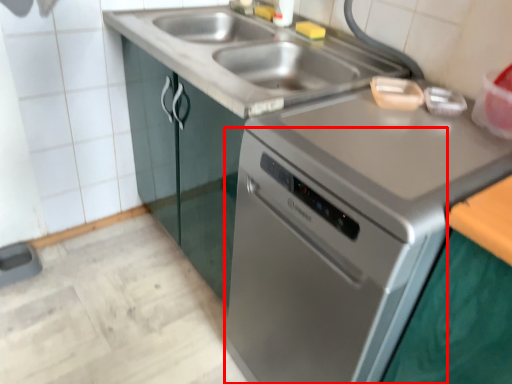
Question: From the image's perspective, considering the relative positions of oven (annotated by the red box) and sink in the image provided, where is oven (annotated by the red box) located with respect to the staircase?

Choices:
 (A) above
 (B) below

Answer: (B)